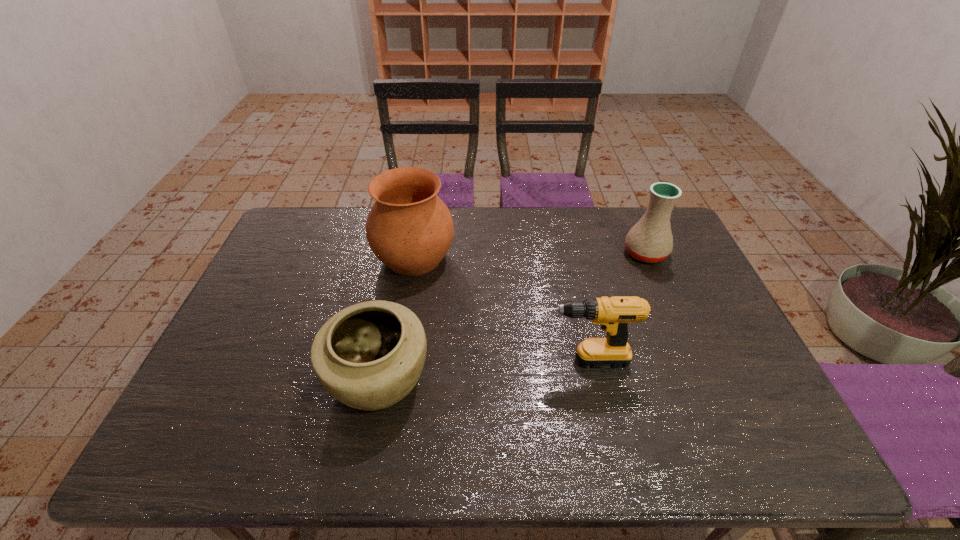
The image size is (960, 540). Find the location of `the rightmost pottery`. the rightmost pottery is located at coordinates (650, 240).

At what (x,y) coordinates should I click in order to perform the action: click on the second object from right to left. Please return your answer as a coordinate pair (x, y). The image size is (960, 540). Looking at the image, I should click on (613, 314).

This screenshot has height=540, width=960. Find the location of `the shortest object`. the shortest object is located at coordinates (369, 356).

Locate an element on the screen. Image resolution: width=960 pixels, height=540 pixels. the nearest pottery is located at coordinates (369, 356).

At what (x,y) coordinates should I click in order to perform the action: click on vacant area located on the left of the rightmost pottery. Please return your answer as a coordinate pair (x, y). Looking at the image, I should click on (568, 253).

Locate an element on the screen. This screenshot has width=960, height=540. vacant space situated at the tip of the drill is located at coordinates (375, 360).

What are the coordinates of `free space located 0.170m at the tip of the drill` in the screenshot? It's located at (453, 360).

This screenshot has height=540, width=960. What are the coordinates of `free space located 0.110m at the tip of the drill` in the screenshot? It's located at pyautogui.click(x=477, y=360).

In order to click on vacant space located on the back of the shortest object in this screenshot , I will do `click(392, 312)`.

Identify the location of object situated at the near edge. The image size is (960, 540). (369, 356).